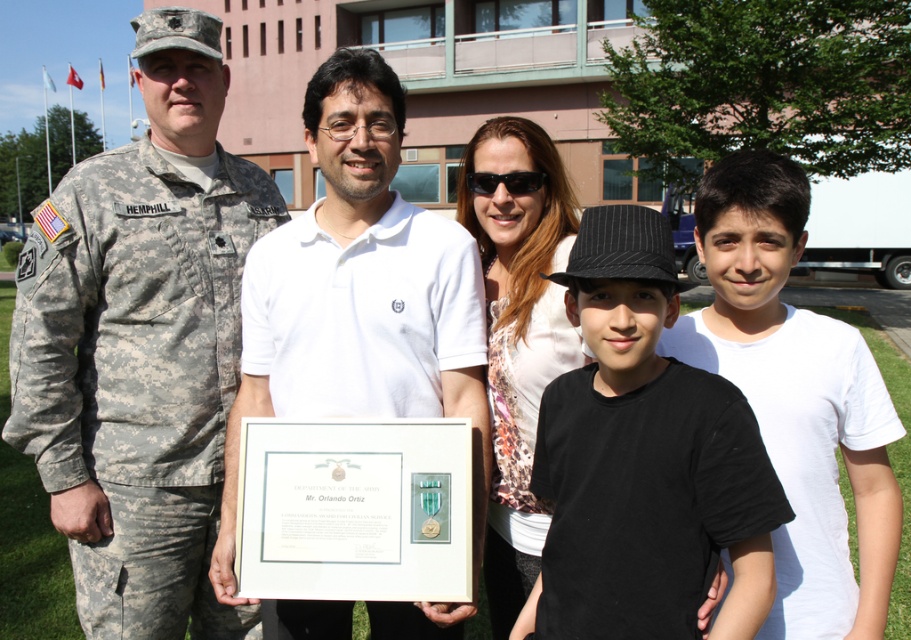
Who is shorter, black matte hat at center or white cotton shirt at right?

black matte hat at center

Can you confirm if black matte hat at center is smaller than white cotton shirt at right?

Yes, black matte hat at center is smaller than white cotton shirt at right.

The width and height of the screenshot is (911, 640). Describe the element at coordinates (643, 460) in the screenshot. I see `black matte hat at center` at that location.

Identify the location of black matte hat at center. (643, 460).

Does camouflage uniform at left appear over white cotton shirt at right?

Correct, camouflage uniform at left is located above white cotton shirt at right.

Between camouflage uniform at left and white cotton shirt at right, which one has more height?

camouflage uniform at left

The height and width of the screenshot is (640, 911). I want to click on camouflage uniform at left, so click(141, 344).

Which is more to the left, white cotton shirt at right or white printed shirt at center?

From the viewer's perspective, white printed shirt at center appears more on the left side.

Image resolution: width=911 pixels, height=640 pixels. What are the coordinates of `white cotton shirt at right` in the screenshot? It's located at (796, 397).

What do you see at coordinates (796, 397) in the screenshot? I see `white cotton shirt at right` at bounding box center [796, 397].

The width and height of the screenshot is (911, 640). I want to click on white cotton shirt at right, so click(796, 397).